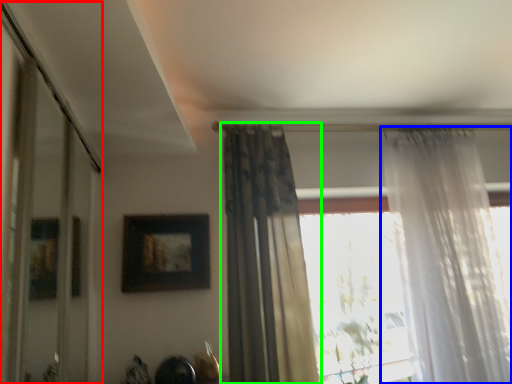
Question: Considering the real-world distances, which object is farthest from glass door (highlighted by a red box)? curtain (highlighted by a blue box) or curtain (highlighted by a green box)?

Choices:
 (A) curtain
 (B) curtain

Answer: (A)